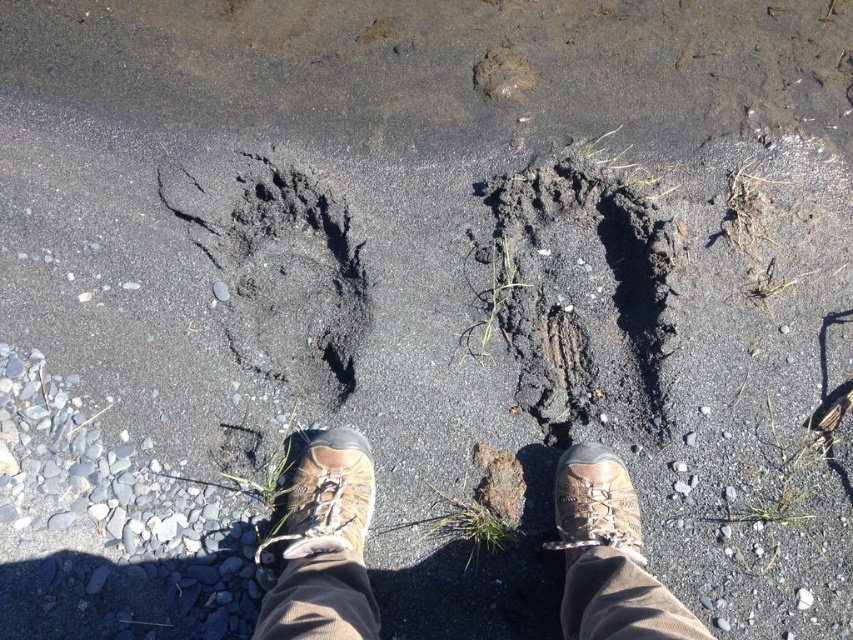
Question: Does brown leather shoes at center have a lesser width compared to brown leather shoe at center?

Choices:
 (A) no
 (B) yes

Answer: (A)

Question: Estimate the real-world distances between objects in this image. Which object is farther from the brown leather shoe at center?

Choices:
 (A) dark gray mud footprint at center
 (B) dark mud footprint at center
 (C) brown leather shoes at center

Answer: (B)

Question: Is the position of brown leather shoes at center more distant than that of brown leather shoe at center?

Choices:
 (A) no
 (B) yes

Answer: (A)

Question: Which point is farther from the camera taking this photo?

Choices:
 (A) (584, 456)
 (B) (312, 461)

Answer: (A)

Question: Does dark mud footprint at center appear on the left side of brown leather shoe at center?

Choices:
 (A) no
 (B) yes

Answer: (A)

Question: Based on their relative distances, which object is farther from the dark mud footprint at center?

Choices:
 (A) brown leather shoe at center
 (B) dark gray mud footprint at center

Answer: (A)